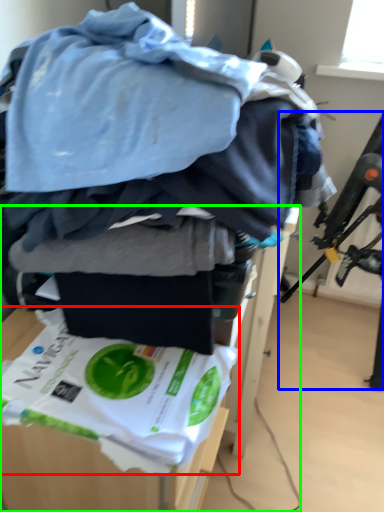
Question: Which object is positioned farthest from waste (highlighted by a red box)? Select from swivel chair (highlighted by a blue box) and furniture (highlighted by a green box).

Choices:
 (A) swivel chair
 (B) furniture

Answer: (A)